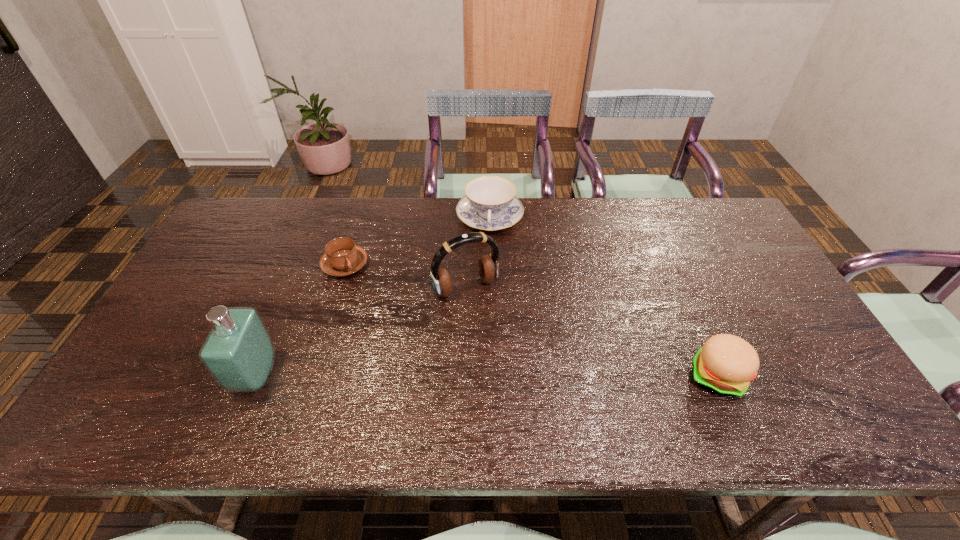
The height and width of the screenshot is (540, 960). Find the location of `free spot on the desktop that is between the leftmost object and the hamburger and is positioned on the ear cup of the second tallest object`. free spot on the desktop that is between the leftmost object and the hamburger and is positioned on the ear cup of the second tallest object is located at coordinates (517, 376).

Find the location of a particular element. The height and width of the screenshot is (540, 960). free space on the desktop that is between the perfume and the rightmost object and is positioned on the side of the shortest object with the handle is located at coordinates (528, 376).

Identify the location of vacant space on the desktop that is between the leftmost object and the rightmost object and is positioned with the handle on the side of the farthest object. The image size is (960, 540). (496, 376).